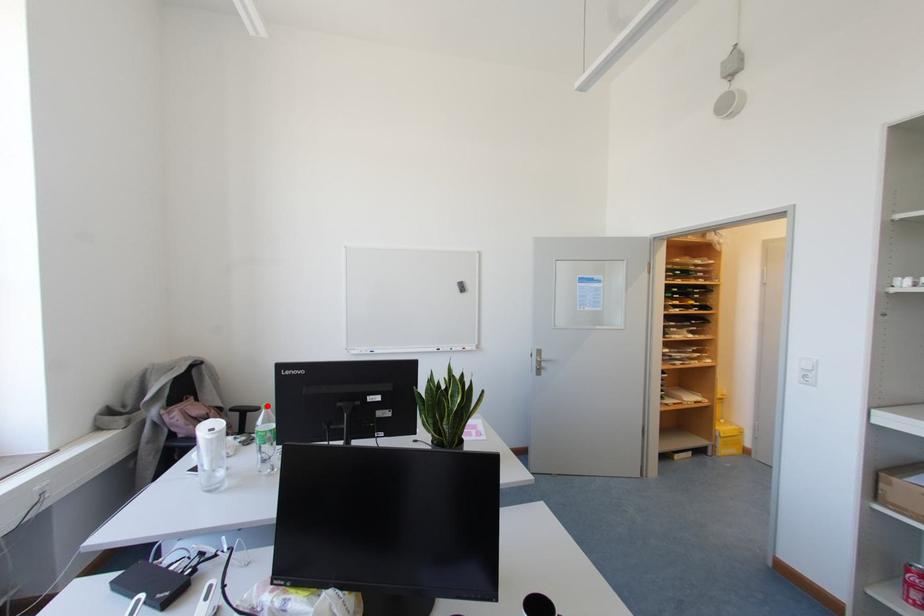
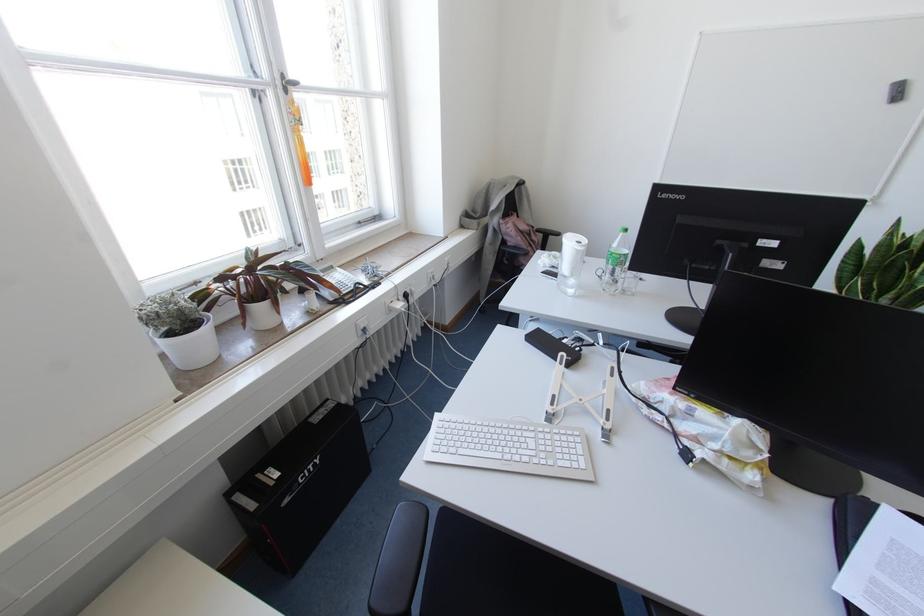
The point at the highlighted location is marked in the first image. Where is the corresponding point in the second image?

(625, 229)